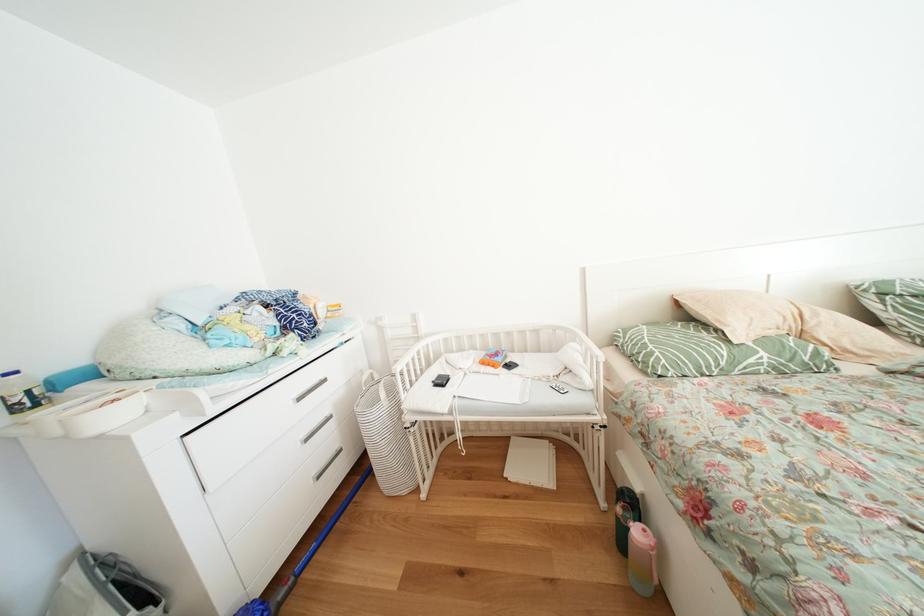
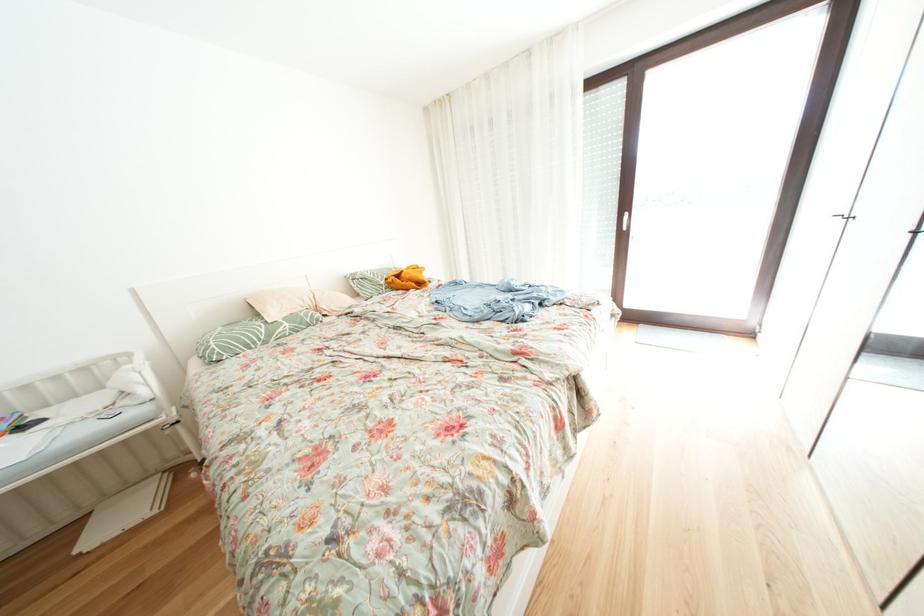
In the second image, find the point that corresponds to (x=772, y=359) in the first image.

(296, 329)